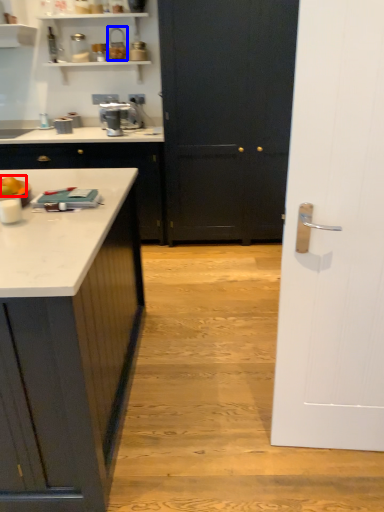
Question: Among these objects, which one is nearest to the camera, food (highlighted by a red box) or appliance (highlighted by a blue box)?

Choices:
 (A) food
 (B) appliance

Answer: (A)